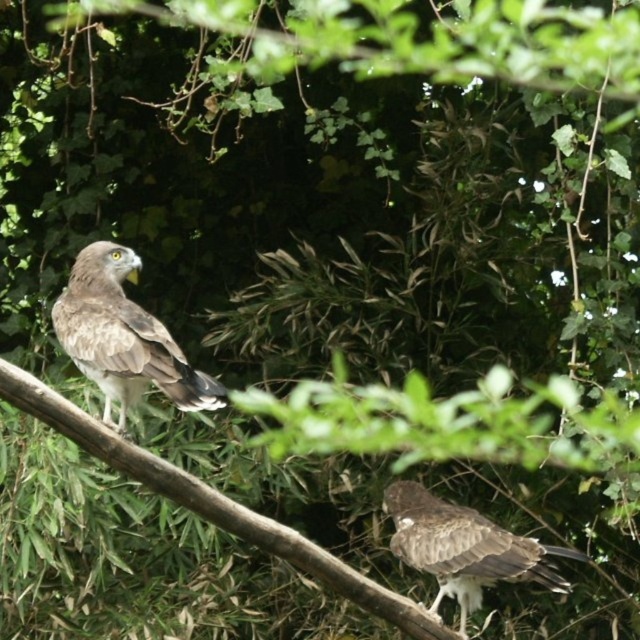
Question: Which point is farther to the camera?

Choices:
 (A) (532, 541)
 (B) (403, 611)
 (C) (64, 336)

Answer: (A)

Question: Considering the relative positions of brown wood at left and brown feathered bird at center in the image provided, where is brown wood at left located with respect to brown feathered bird at center?

Choices:
 (A) right
 (B) left

Answer: (B)

Question: Where is brown feathered eagle at upper left located in relation to brown feathered bird at center in the image?

Choices:
 (A) above
 (B) below

Answer: (A)

Question: Which object is positioned closest to the brown feathered bird at center?

Choices:
 (A) brown feathered eagle at upper left
 (B) brown wood at left

Answer: (B)

Question: From the image, what is the correct spatial relationship of brown wood at left in relation to brown feathered bird at center?

Choices:
 (A) below
 (B) above

Answer: (B)

Question: Which point appears closest to the camera in this image?

Choices:
 (A) (508, 563)
 (B) (93, 339)

Answer: (B)